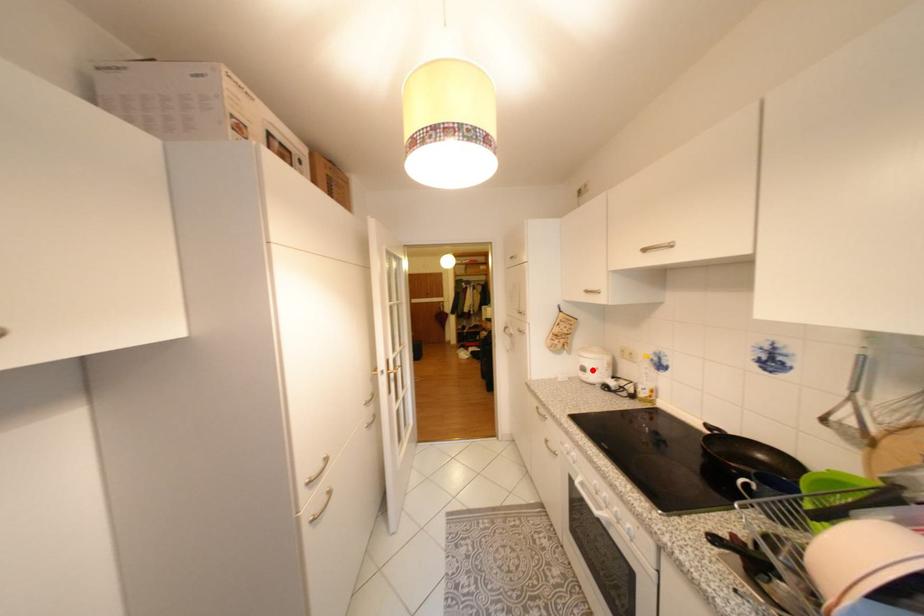
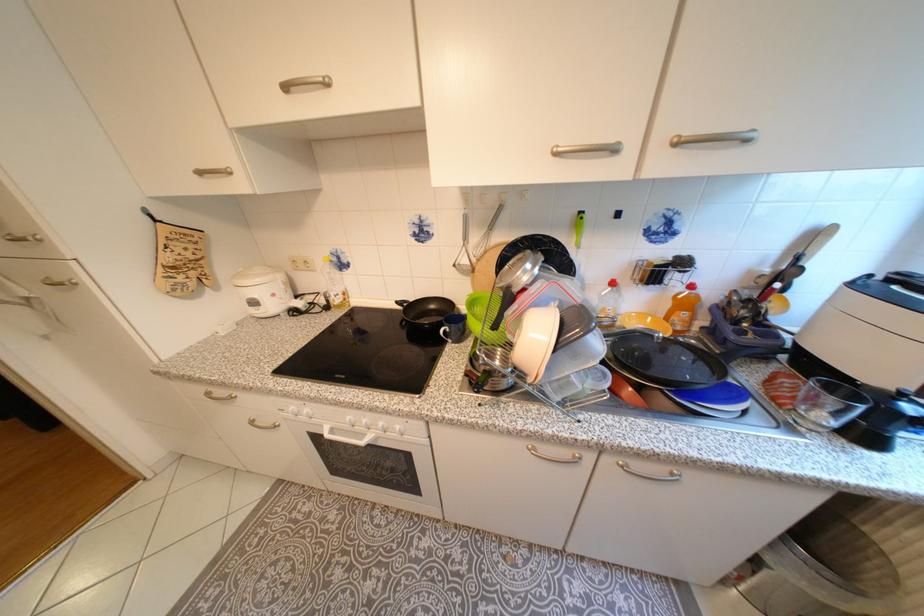
Locate, in the second image, the point that corresponds to the highlighted location in the first image.

(263, 304)